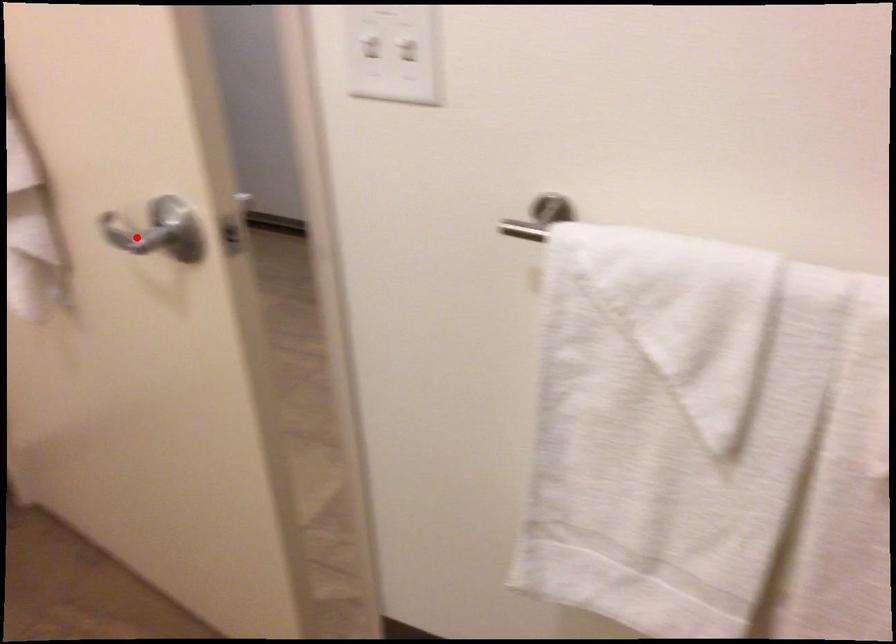
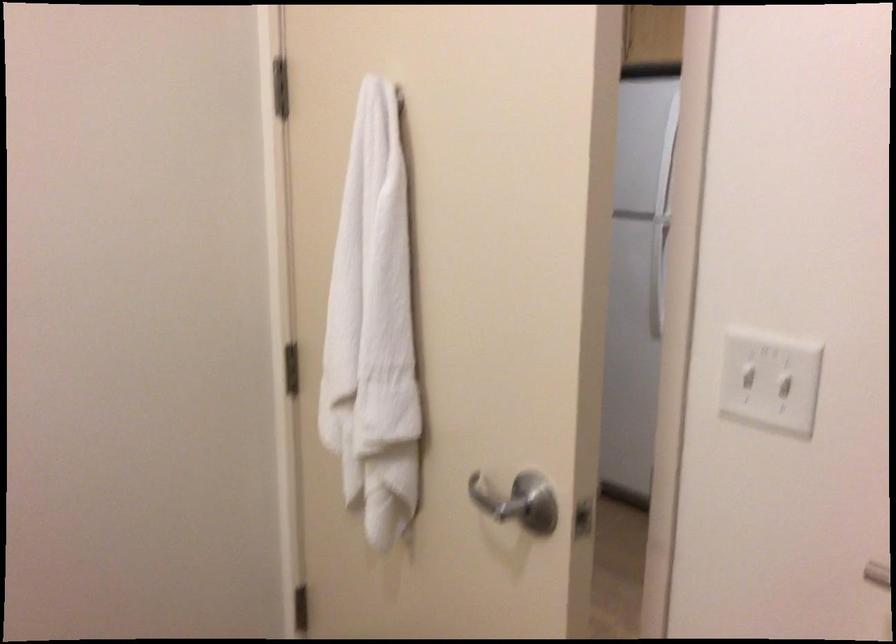
Question: I am providing you with two images of the same scene from different viewpoints. In image1, a red point is highlighted. Considering the same 3D point in image2, which of the following is correct?

Choices:
 (A) It is closer
 (B) It is farther

Answer: (B)